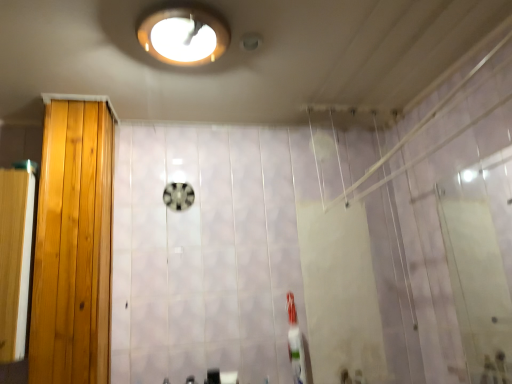
Question: Does matte white light fixture at upper center come in front of light brown wood door at left?

Choices:
 (A) yes
 (B) no

Answer: (A)

Question: Are matte white light fixture at upper center and light brown wood door at left making contact?

Choices:
 (A) yes
 (B) no

Answer: (B)

Question: Is matte white light fixture at upper center further to the viewer compared to light brown wood door at left?

Choices:
 (A) yes
 (B) no

Answer: (B)

Question: Is matte white light fixture at upper center oriented away from light brown wood door at left?

Choices:
 (A) yes
 (B) no

Answer: (B)

Question: From the image's perspective, is matte white light fixture at upper center located beneath light brown wood door at left?

Choices:
 (A) yes
 (B) no

Answer: (B)

Question: From a real-world perspective, is matte white light fixture at upper center physically below light brown wood door at left?

Choices:
 (A) no
 (B) yes

Answer: (A)

Question: From a real-world perspective, is transparent glass screen door at right, the 1th screen door from the right, positioned over wooden screen door at left, arranged as the first screen door when viewed from the left, based on gravity?

Choices:
 (A) no
 (B) yes

Answer: (A)

Question: Is transparent glass screen door at right, the second screen door viewed from the left, directly adjacent to wooden screen door at left, which ranks as the second screen door in right-to-left order?

Choices:
 (A) yes
 (B) no

Answer: (B)

Question: Can you confirm if transparent glass screen door at right, the second screen door viewed from the left, is shorter than wooden screen door at left, arranged as the first screen door when viewed from the left?

Choices:
 (A) no
 (B) yes

Answer: (A)

Question: Considering the relative sizes of transparent glass screen door at right, the second screen door viewed from the left, and wooden screen door at left, arranged as the first screen door when viewed from the left, in the image provided, is transparent glass screen door at right, the second screen door viewed from the left, bigger than wooden screen door at left, arranged as the first screen door when viewed from the left,?

Choices:
 (A) no
 (B) yes

Answer: (A)

Question: Is transparent glass screen door at right, the second screen door viewed from the left, oriented away from wooden screen door at left, which ranks as the second screen door in right-to-left order?

Choices:
 (A) yes
 (B) no

Answer: (B)

Question: Considering the relative positions of transparent glass screen door at right, the 1th screen door from the right, and wooden screen door at left, arranged as the first screen door when viewed from the left, in the image provided, is transparent glass screen door at right, the 1th screen door from the right, behind wooden screen door at left, arranged as the first screen door when viewed from the left,?

Choices:
 (A) no
 (B) yes

Answer: (A)

Question: Can you confirm if wooden screen door at left, which ranks as the second screen door in right-to-left order, is smaller than light brown wood door at left?

Choices:
 (A) yes
 (B) no

Answer: (A)